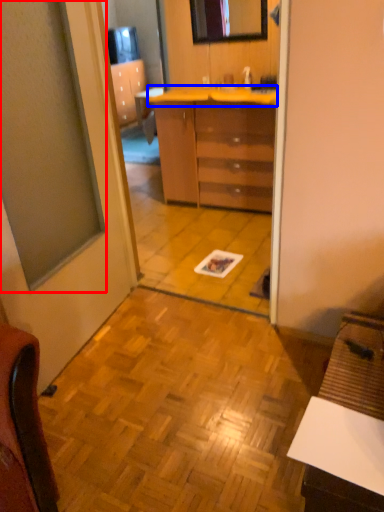
Question: Which object is further to the camera taking this photo, window (highlighted by a red box) or counter top (highlighted by a blue box)?

Choices:
 (A) window
 (B) counter top

Answer: (B)